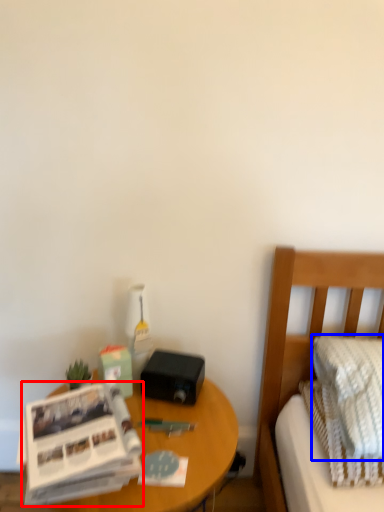
Question: Which object appears closest to the camera in this image, paperback book (highlighted by a red box) or pillow (highlighted by a blue box)?

Choices:
 (A) paperback book
 (B) pillow

Answer: (A)